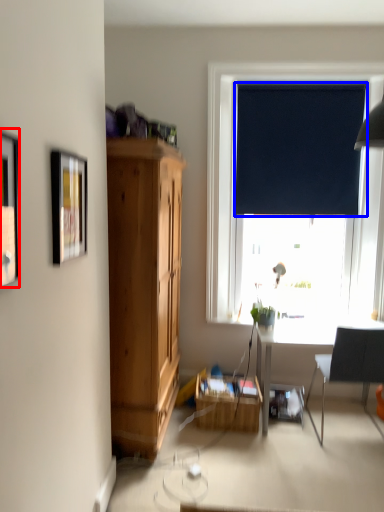
Question: Which object appears farthest to the camera in this image, picture frame (highlighted by a red box) or curtain (highlighted by a blue box)?

Choices:
 (A) picture frame
 (B) curtain

Answer: (B)